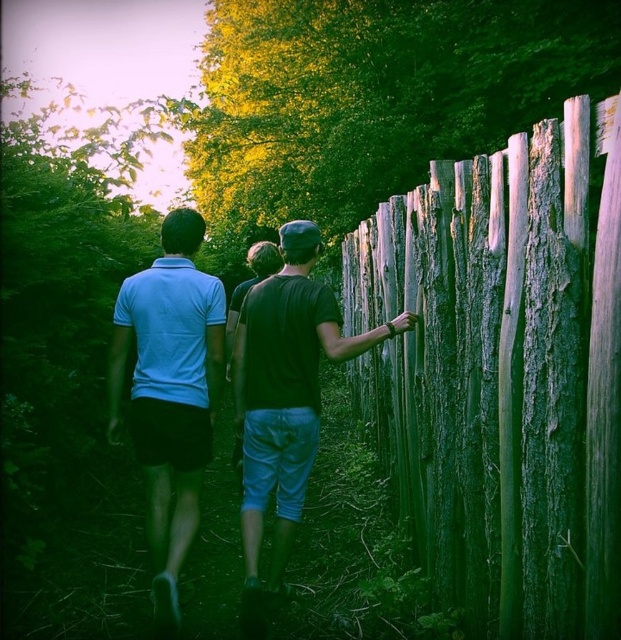
You are standing on the dirt path and want to see what is behind the weathered wood fence at right. Can you see the matte black shirt at right from your current position?

The weathered wood fence at right is much taller than the matte black shirt at right, so the fence blocks the view of the matte black shirt at right.

You are standing on the dirt path and want to take a photo of the matte black shirt at right and the weathered wood fence at right. Which object should you position closer to the left side of the frame to include both in the photo?

You should position the matte black shirt at right closer to the left side of the frame since the weathered wood fence at right is already to the right of it.

You are standing at the start of the path and see the matte blue shirt at center and the matte black shirt at right walking away from you. Which direction are they walking relative to each other?

The matte blue shirt at center is to the left of the matte black shirt at right, so they are walking away from you with the matte blue shirt at center on the left side and the matte black shirt at right on the right side.